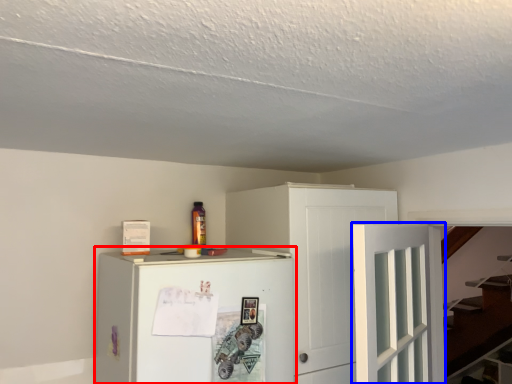
Question: Which object appears closest to the camera in this image, refrigerator (highlighted by a red box) or door (highlighted by a blue box)?

Choices:
 (A) refrigerator
 (B) door

Answer: (B)